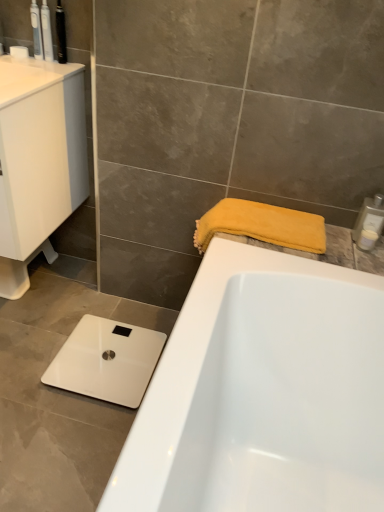
Question: Considering the relative positions of white glossy sink at left and metallic black toothbrush at upper left, arranged as the 3th toiletry when viewed from the left, in the image provided, is white glossy sink at left to the left of metallic black toothbrush at upper left, arranged as the 3th toiletry when viewed from the left, from the viewer's perspective?

Choices:
 (A) no
 (B) yes

Answer: (B)

Question: From the image's perspective, is white glossy sink at left on metallic black toothbrush at upper left, the third toiletry when ordered from top to bottom?

Choices:
 (A) no
 (B) yes

Answer: (A)

Question: Does white glossy sink at left have a greater height compared to metallic black toothbrush at upper left, arranged as the 3th toiletry when viewed from the left?

Choices:
 (A) no
 (B) yes

Answer: (B)

Question: From the image's perspective, does white glossy sink at left appear lower than metallic black toothbrush at upper left, the third toiletry positioned from the bottom?

Choices:
 (A) yes
 (B) no

Answer: (A)

Question: Considering the relative sizes of white glossy sink at left and metallic black toothbrush at upper left, arranged as the 3th toiletry when viewed from the left, in the image provided, is white glossy sink at left smaller than metallic black toothbrush at upper left, arranged as the 3th toiletry when viewed from the left,?

Choices:
 (A) no
 (B) yes

Answer: (A)

Question: Is metallic black toothbrush at upper left, the third toiletry when ordered from top to bottom, taller or shorter than translucent plastic toothbrush at upper left, which is the first toiletry in top-to-bottom order?

Choices:
 (A) short
 (B) tall

Answer: (A)

Question: Would you say metallic black toothbrush at upper left, the third toiletry positioned from the bottom, is to the left or to the right of translucent plastic toothbrush at upper left, which ranks as the fifth toiletry in bottom-to-top order, in the picture?

Choices:
 (A) left
 (B) right

Answer: (B)

Question: Considering their positions, is metallic black toothbrush at upper left, the third toiletry when ordered from top to bottom, located in front of or behind translucent plastic toothbrush at upper left, which is the first toiletry in top-to-bottom order?

Choices:
 (A) behind
 (B) front

Answer: (B)

Question: Is metallic black toothbrush at upper left, acting as the 3th toiletry starting from the right, inside or outside of translucent plastic toothbrush at upper left, which ranks as the fifth toiletry in bottom-to-top order?

Choices:
 (A) inside
 (B) outside

Answer: (B)

Question: From a real-world perspective, is white glossy sink at left physically located above or below white plastic soap dispenser at upper right, which is the fourth toiletry in left-to-right order?

Choices:
 (A) below
 (B) above

Answer: (A)

Question: Is point click(x=1, y=181) closer or farther from the camera than point click(x=370, y=245)?

Choices:
 (A) closer
 (B) farther

Answer: (A)

Question: Is white glossy sink at left in front of or behind white plastic soap dispenser at upper right, which is the fourth toiletry in left-to-right order, in the image?

Choices:
 (A) front
 (B) behind

Answer: (A)

Question: Do you think white glossy sink at left is within white plastic soap dispenser at upper right, which is the 5th toiletry in top-to-bottom order, or outside of it?

Choices:
 (A) outside
 (B) inside

Answer: (A)

Question: Is metallic black toothbrush at upper left, the third toiletry when ordered from top to bottom, in front of or behind white plastic soap dispenser at upper right, which ranks as the second toiletry in right-to-left order, in the image?

Choices:
 (A) behind
 (B) front

Answer: (A)

Question: Is metallic black toothbrush at upper left, the third toiletry positioned from the bottom, situated inside white plastic soap dispenser at upper right, the first toiletry positioned from the bottom, or outside?

Choices:
 (A) inside
 (B) outside

Answer: (B)